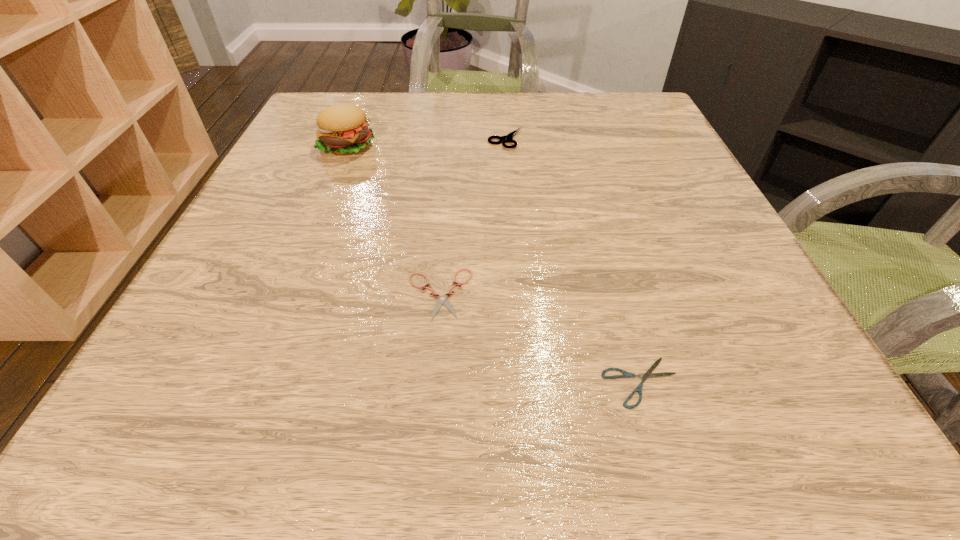
Locate an element on the screen. The width and height of the screenshot is (960, 540). free space that is in between the second nearest shears and the rightmost object is located at coordinates (540, 338).

Where is `object that is the second closest to the nearest shears`? Image resolution: width=960 pixels, height=540 pixels. object that is the second closest to the nearest shears is located at coordinates (507, 138).

Choose which object is the third nearest neighbor to the nearest object. Please provide its 2D coordinates. Your answer should be formatted as a tuple, i.e. [(x, y)], where the tuple contains the x and y coordinates of a point satisfying the conditions above.

[(342, 129)]

Find the location of `shears that stands as the second closest to the leftmost object`. shears that stands as the second closest to the leftmost object is located at coordinates (441, 300).

Identify which shears is the third nearest to the leftmost object. Please provide its 2D coordinates. Your answer should be formatted as a tuple, i.e. [(x, y)], where the tuple contains the x and y coordinates of a point satisfying the conditions above.

[(648, 374)]

Find the location of a particular element. vacant space that satisfies the following two spatial constraints: 1. on the back side of the second shortest shears; 2. on the right side of the second tallest object is located at coordinates (452, 139).

This screenshot has height=540, width=960. Identify the location of free region that satisfies the following two spatial constraints: 1. on the back side of the leftmost object; 2. on the right side of the farthest shears. (350, 139).